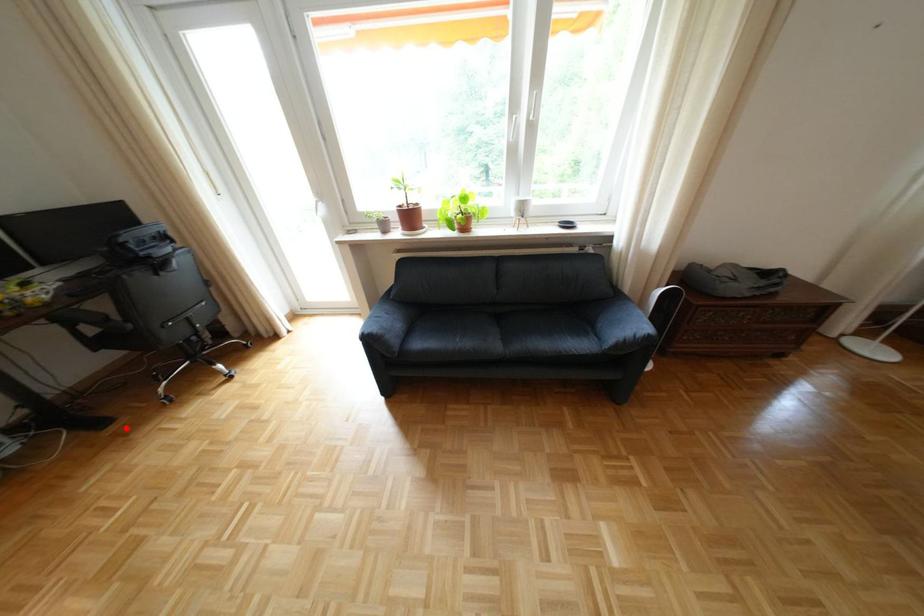
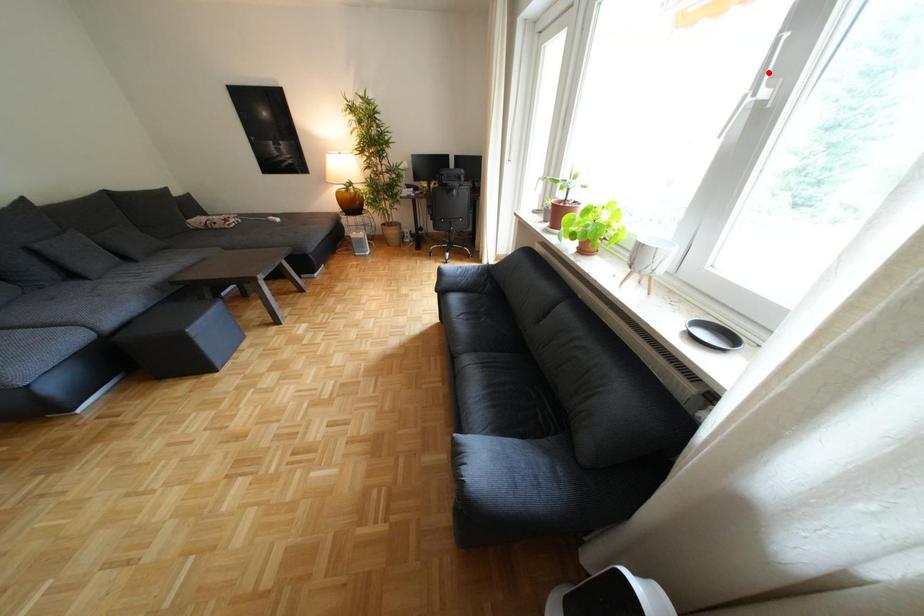
I am providing you with two images of the same scene from different viewpoints. A red point is marked on the first image and another point is marked on the second image. Do the highlighted points in image1 and image2 indicate the same real-world spot?

No